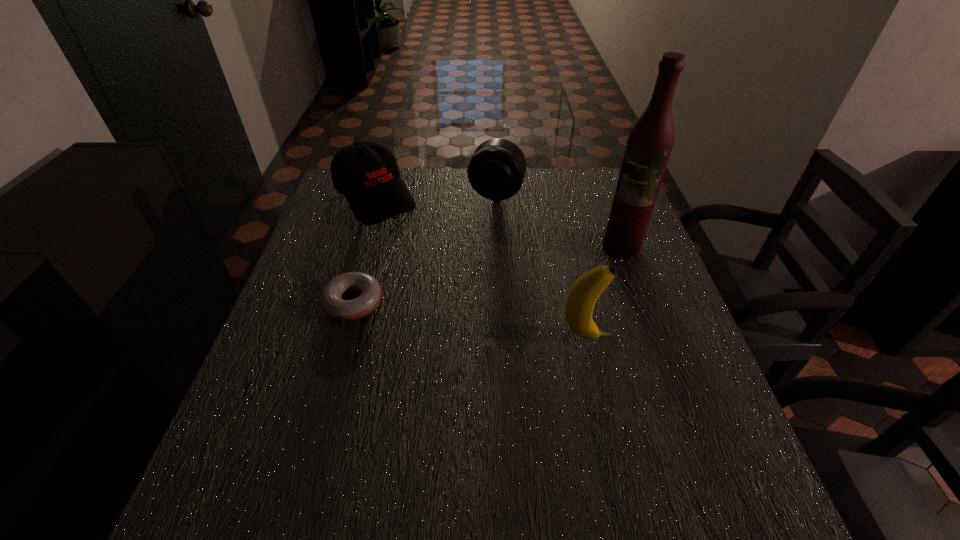
Identify the location of telephoto lens that is at the far edge. The width and height of the screenshot is (960, 540). (496, 171).

Where is `doughnut at the left edge`? The width and height of the screenshot is (960, 540). doughnut at the left edge is located at coordinates (331, 302).

Find the location of `baseball cap at the left edge`. baseball cap at the left edge is located at coordinates (367, 173).

The height and width of the screenshot is (540, 960). I want to click on banana located at the right edge, so click(583, 294).

At what (x,y) coordinates should I click in order to perform the action: click on liquor located in the right edge section of the desktop. Please return your answer as a coordinate pair (x, y). The width and height of the screenshot is (960, 540). Looking at the image, I should click on (650, 141).

Locate an element on the screen. This screenshot has width=960, height=540. object present at the far left corner is located at coordinates (367, 173).

The width and height of the screenshot is (960, 540). In the image, there is a desktop. Find the location of `free space at the far edge`. free space at the far edge is located at coordinates (440, 188).

In the image, there is a desktop. Where is `vacant region at the left edge`? vacant region at the left edge is located at coordinates (311, 301).

You are a GUI agent. You are given a task and a screenshot of the screen. Output one action in this format:
    pyautogui.click(x=<x>, y=<y>)
    Task: Click on the free region at the right edge
    The height and width of the screenshot is (540, 960).
    Given the screenshot: What is the action you would take?
    pyautogui.click(x=643, y=256)

The width and height of the screenshot is (960, 540). I want to click on free region at the near left corner of the desktop, so click(241, 455).